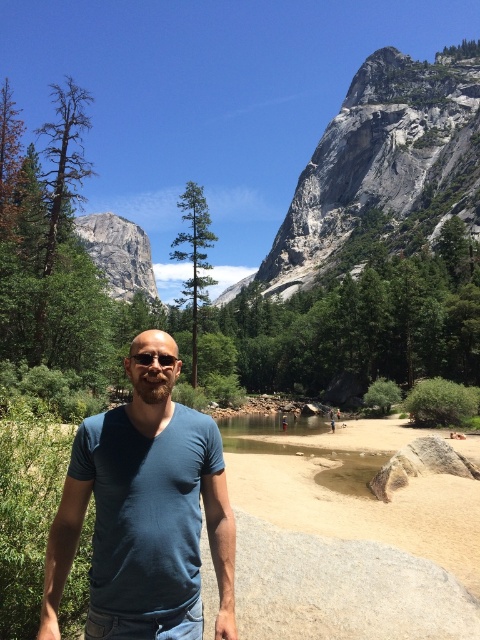
Which is in front, point (316, 161) or point (108, 237)?

Positioned in front is point (316, 161).

Looking at this image, measure the distance between gray/granite mountain at upper right and camera.

A distance of 118.25 meters exists between gray/granite mountain at upper right and camera.

Is point (397, 58) positioned behind point (112, 256)?

No, (397, 58) is in front of (112, 256).

At what (x,y) coordinates should I click in order to perform the action: click on gray/granite mountain at upper right. Please return your answer as a coordinate pair (x, y). The height and width of the screenshot is (640, 480). Looking at the image, I should click on (383, 164).

Between point (451, 128) and point (219, 557), which one is positioned in front?

Positioned in front is point (219, 557).

Is point (411, 70) closer to viewer compared to point (107, 419)?

No, it is not.

Image resolution: width=480 pixels, height=640 pixels. Find the location of `gray/granite mountain at upper right`. gray/granite mountain at upper right is located at coordinates (383, 164).

Does gray rough rock at lower right have a larger size compared to clear plastic goggles at center?

Correct, gray rough rock at lower right is larger in size than clear plastic goggles at center.

I want to click on gray rough rock at lower right, so click(420, 465).

What are the coordinates of `gray rough rock at lower right` in the screenshot? It's located at (420, 465).